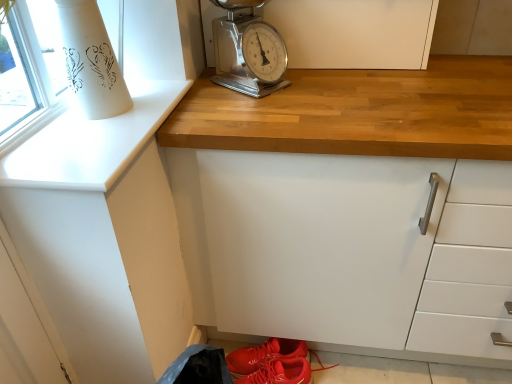
Question: Considering the relative sizes of metallic scale at upper center and shiny leather sneakers at lower center in the image provided, is metallic scale at upper center smaller than shiny leather sneakers at lower center?

Choices:
 (A) yes
 (B) no

Answer: (B)

Question: Is metallic scale at upper center thinner than shiny leather sneakers at lower center?

Choices:
 (A) no
 (B) yes

Answer: (A)

Question: Is metallic scale at upper center positioned with its back to shiny leather sneakers at lower center?

Choices:
 (A) no
 (B) yes

Answer: (A)

Question: From the image's perspective, would you say metallic scale at upper center is shown under shiny leather sneakers at lower center?

Choices:
 (A) no
 (B) yes

Answer: (A)

Question: Can you confirm if metallic scale at upper center is positioned to the right of shiny leather sneakers at lower center?

Choices:
 (A) no
 (B) yes

Answer: (A)

Question: From a real-world perspective, relative to white matte cabinet at upper center, placed as the 2th cabinetry when sorted from back to front, is metallic scale at upper center vertically above or below?

Choices:
 (A) above
 (B) below

Answer: (B)

Question: In terms of height, does metallic scale at upper center look taller or shorter compared to white matte cabinet at upper center, placed as the 2th cabinetry when sorted from back to front?

Choices:
 (A) short
 (B) tall

Answer: (A)

Question: Looking at their shapes, would you say metallic scale at upper center is wider or thinner than white matte cabinet at upper center, marked as the 1th cabinetry in a front-to-back arrangement?

Choices:
 (A) thin
 (B) wide

Answer: (A)

Question: Considering the relative positions of metallic scale at upper center and white matte cabinet at upper center, placed as the 2th cabinetry when sorted from back to front, in the image provided, is metallic scale at upper center to the left or to the right of white matte cabinet at upper center, placed as the 2th cabinetry when sorted from back to front,?

Choices:
 (A) left
 (B) right

Answer: (B)

Question: Is shiny leather sneakers at lower center situated inside white matte cabinet at upper center, the second cabinetry from the front, or outside?

Choices:
 (A) outside
 (B) inside

Answer: (A)

Question: In the image, is shiny leather sneakers at lower center positioned in front of or behind white matte cabinet at upper center, the second cabinetry from the front?

Choices:
 (A) front
 (B) behind

Answer: (B)

Question: Does point (272, 354) appear closer or farther from the camera than point (338, 61)?

Choices:
 (A) closer
 (B) farther

Answer: (B)

Question: From the image's perspective, relative to white matte cabinet at upper center, the second cabinetry from the front, is shiny leather sneakers at lower center above or below?

Choices:
 (A) below
 (B) above

Answer: (A)

Question: Is white matte cabinet at upper center, placed as the first cabinetry when sorted from back to front, wider or thinner than metallic scale at upper center?

Choices:
 (A) wide
 (B) thin

Answer: (B)

Question: From the image's perspective, is white matte cabinet at upper center, the second cabinetry from the front, above or below metallic scale at upper center?

Choices:
 (A) below
 (B) above

Answer: (B)